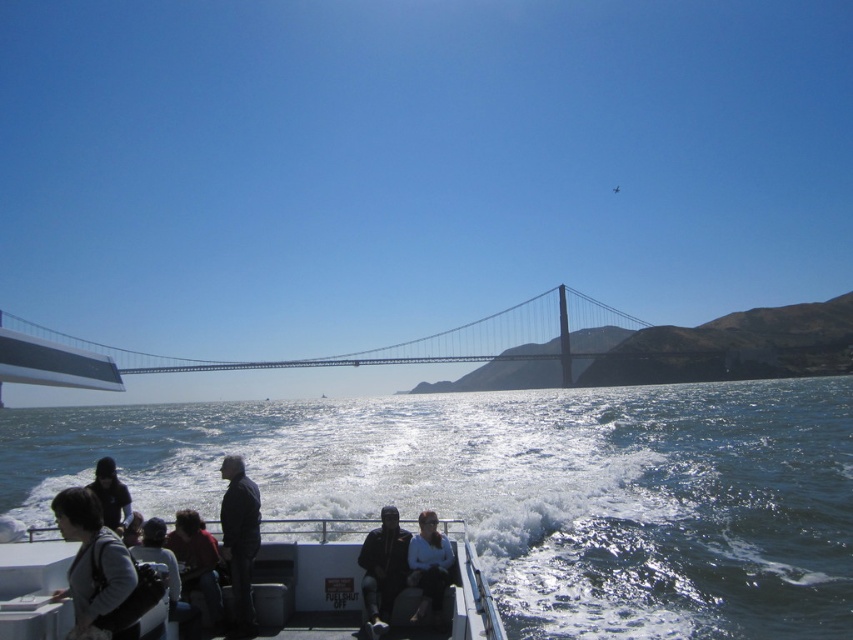
In the scene shown: You are standing on the boat and looking at the clear blue water at lower center and the white fabric shirt at center. Which object is closer to you?

The white fabric shirt at center is closer to you because the clear blue water at lower center is further away.

You are standing on the deck of the boat and want to reach a specific point marked at coordinates point [318,461]. If your maximum comfortable walking distance is 150 feet, can you safely walk to that point without feeling uncomfortable?

The distance of point [318,461] from viewer is 156.60 feet, which exceeds your maximum comfortable walking distance of 150 feet. Therefore, walking to that point may make you feel uncomfortable.

You are standing on the boat and want to place your dark brown leather jacket at lower left on the clear blue water at lower center. Is the jacket larger or smaller than the water surface area available?

The clear blue water at lower center is larger in size than the dark brown leather jacket at lower left, so the water surface area is bigger than the jacket. Therefore, the jacket can be placed on the water without any issue.